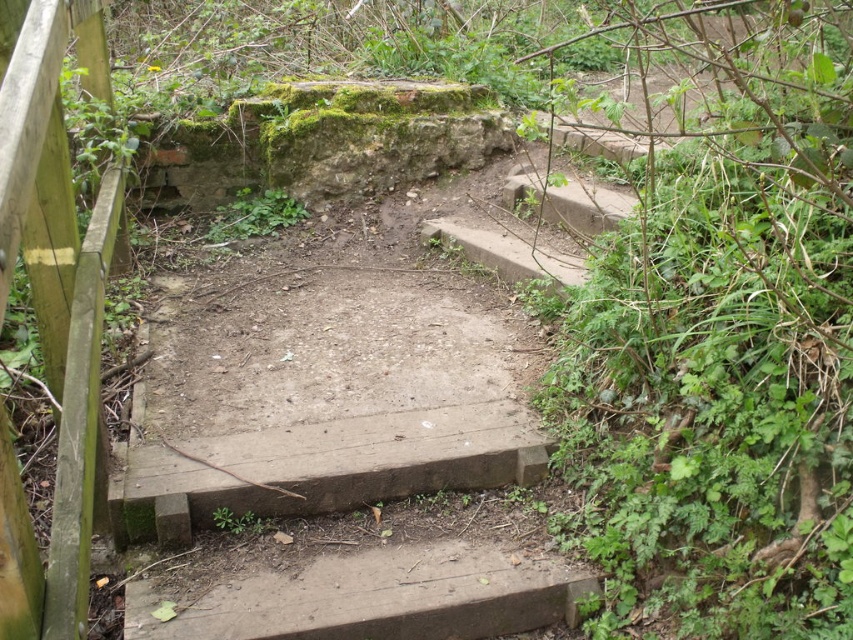
You are standing in front of the stone structure and want to take a photo of the wooden fence at left without the green leafy plant at upper right blocking the view. How should you position yourself?

Move to the left side of the green leafy plant at upper right so that the wooden fence at left becomes visible without obstruction.

You are a gardener planning to trim the green leafy plant at upper right and the wooden fence at left. Which object requires more time to trim based on their sizes?

The green leafy plant at upper right requires more time to trim since it has a larger size compared to the wooden fence at left.